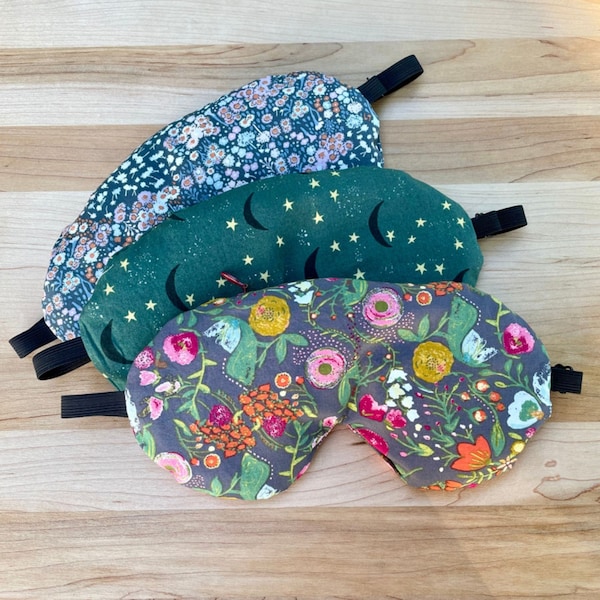
The height and width of the screenshot is (600, 600). Find the location of `light shining down on table`. light shining down on table is located at coordinates (535, 557), (599, 446), (582, 20).